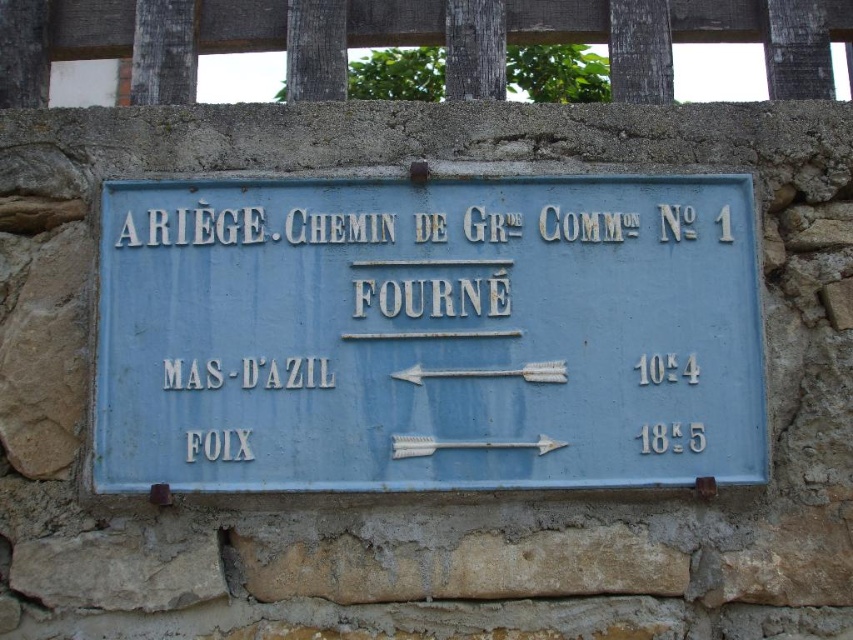
You are examining a signboard with wooden slats at upper center and a white metallic arrow at center. Which object on the signboard takes up more space?

The wooden slats at upper center is larger in size than the white metallic arrow at center, so it takes up more space.